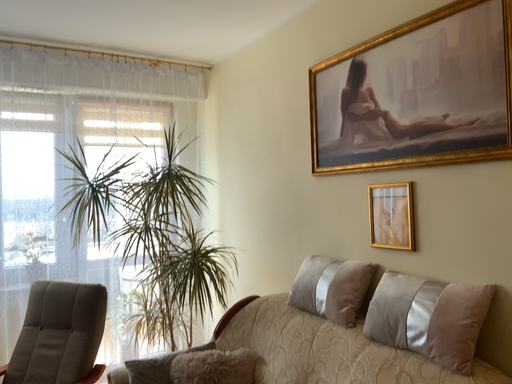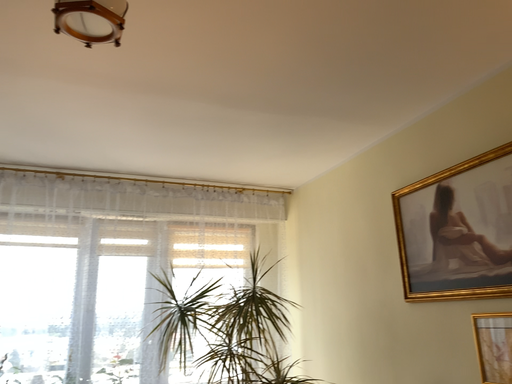
Question: How did the camera likely rotate when shooting the video?

Choices:
 (A) rotated upward
 (B) rotated downward

Answer: (A)